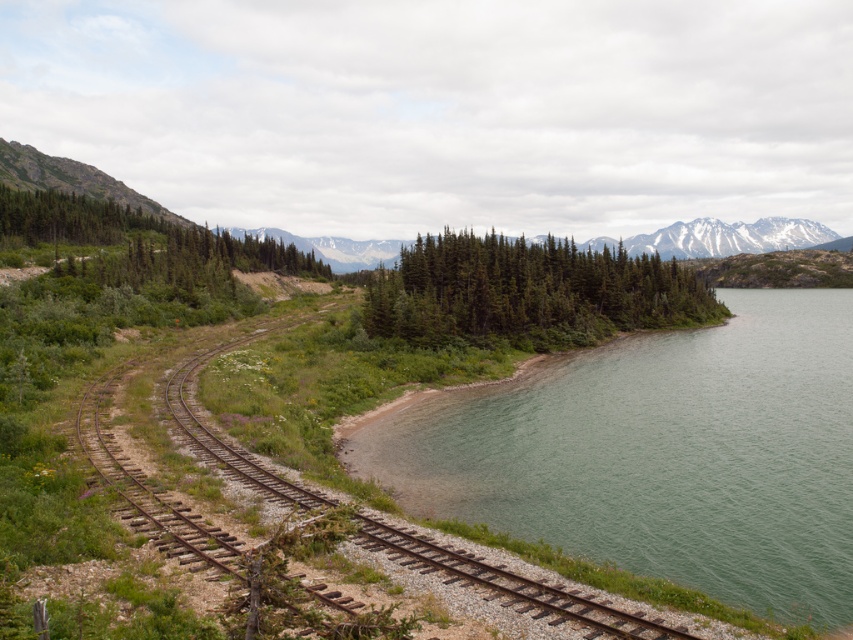
Question: Among these objects, which one is nearest to the camera?

Choices:
 (A) green textured trees at center
 (B) brown metal track at left

Answer: (B)

Question: Can you confirm if green textured trees at center is smaller than brown metal track at left?

Choices:
 (A) yes
 (B) no

Answer: (B)

Question: Which point is farther to the camera?

Choices:
 (A) (190, 401)
 (B) (550, 273)

Answer: (B)

Question: Does green smooth water at center right have a greater width compared to green textured trees at center?

Choices:
 (A) no
 (B) yes

Answer: (B)

Question: Which object is the closest to the green smooth water at center right?

Choices:
 (A) green textured trees at center
 (B) brown metal track at left

Answer: (A)

Question: Is the position of green textured trees at center more distant than that of brown metal track at left?

Choices:
 (A) no
 (B) yes

Answer: (B)